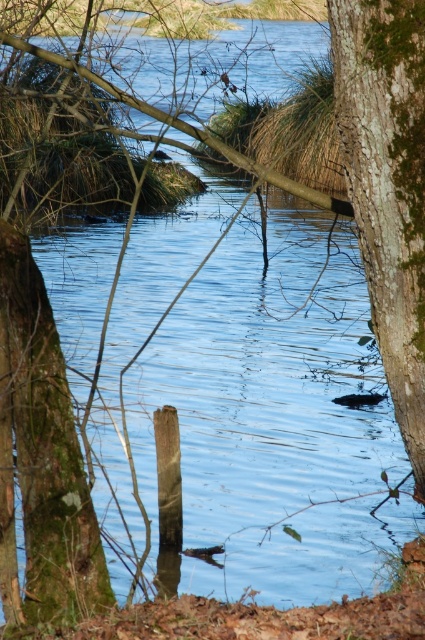
You are a GUI agent. You are given a task and a screenshot of the screen. Output one action in this format:
    pyautogui.click(x=<x>, y=<y>)
    Task: Click on the green mossy bark at right
    The height and width of the screenshot is (640, 425).
    Given the screenshot: What is the action you would take?
    pyautogui.click(x=388, y=186)

Which is below, green mossy bark at right or green mossy tree trunk at lower left?

green mossy tree trunk at lower left

Is point (422, 273) in front of point (73, 435)?

Yes.

Locate an element on the screen. green mossy bark at right is located at coordinates (388, 186).